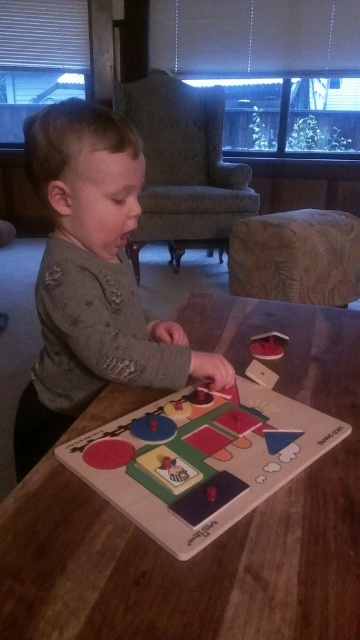
Question: Considering the real-world distances, which object is closest to the wooden puzzle board at center?

Choices:
 (A) gray fabric toddler at center
 (B) wooden puzzle at center
 (C) matte plastic toy at center

Answer: (B)

Question: Which point is closer to the camera taking this photo?

Choices:
 (A) (198, 532)
 (B) (267, 355)
 (C) (348, 550)

Answer: (C)

Question: Is gray fabric toddler at center above matte plastic toy at center?

Choices:
 (A) yes
 (B) no

Answer: (B)

Question: Can you confirm if wooden puzzle board at center is thinner than gray fabric toddler at center?

Choices:
 (A) no
 (B) yes

Answer: (A)

Question: Does wooden puzzle board at center appear on the left side of gray fabric toddler at center?

Choices:
 (A) yes
 (B) no

Answer: (B)

Question: Which object is closer to the camera taking this photo?

Choices:
 (A) wooden puzzle board at center
 (B) wooden puzzle at center
 (C) gray fabric toddler at center
 (D) matte plastic toy at center

Answer: (A)